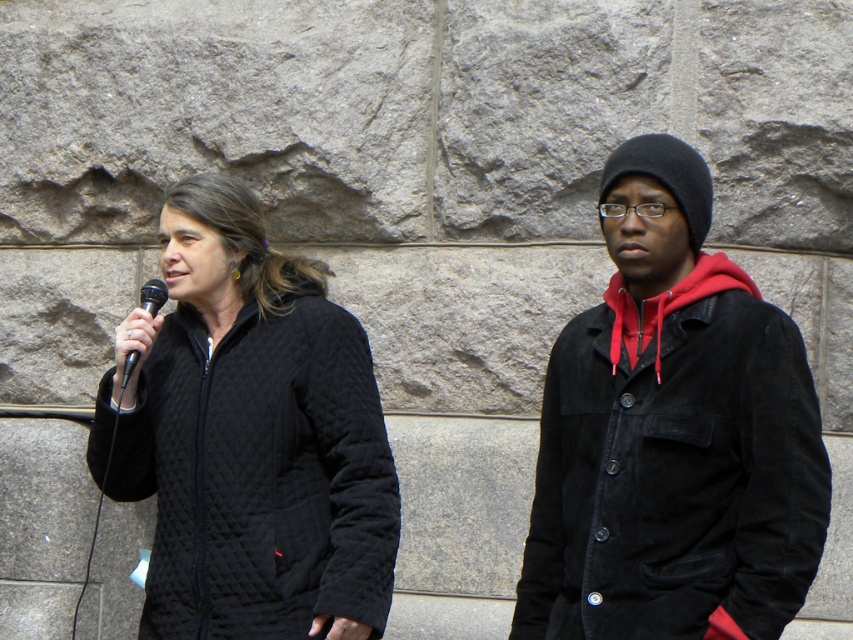
Question: Does suede jacket at right have a larger size compared to quilted black jacket at center?

Choices:
 (A) yes
 (B) no

Answer: (B)

Question: Which point is farther to the camera?

Choices:
 (A) black matte microphone at left
 (B) suede jacket at right

Answer: (A)

Question: Estimate the real-world distances between objects in this image. Which object is closer to the black matte microphone at left?

Choices:
 (A) quilted black jacket at center
 (B) suede jacket at right

Answer: (A)

Question: Can you confirm if quilted black jacket at center is smaller than black matte microphone at left?

Choices:
 (A) yes
 (B) no

Answer: (B)

Question: Can you confirm if suede jacket at right is smaller than quilted black jacket at center?

Choices:
 (A) no
 (B) yes

Answer: (B)

Question: Which of these objects is positioned farthest from the black matte microphone at left?

Choices:
 (A) quilted black jacket at center
 (B) suede jacket at right

Answer: (B)